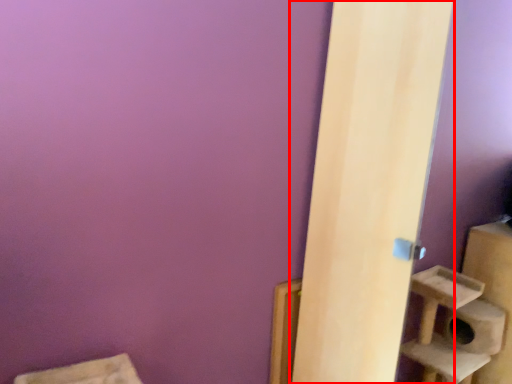
Question: From the image's perspective, where is door (annotated by the red box) located relative to window sill?

Choices:
 (A) above
 (B) below

Answer: (A)